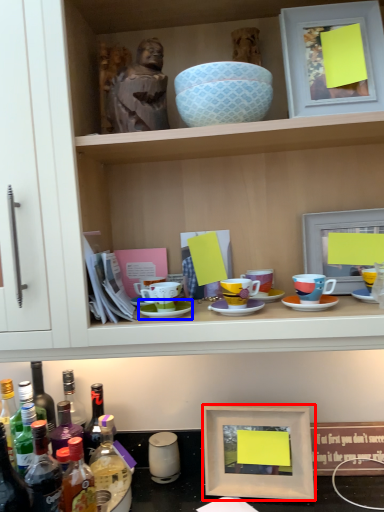
Question: Among these objects, which one is nearest to the camera, picture frame (highlighted by a red box) or saucer (highlighted by a blue box)?

Choices:
 (A) picture frame
 (B) saucer

Answer: (B)